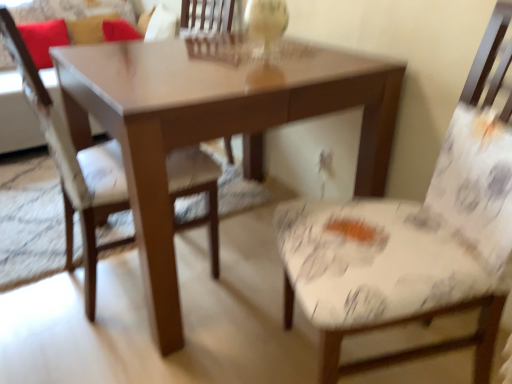
Where is `vacant space positioned to the left of patterned fabric chair at left, marked as the 1th chair in a left-to-right arrangement`? vacant space positioned to the left of patterned fabric chair at left, marked as the 1th chair in a left-to-right arrangement is located at coordinates (31, 265).